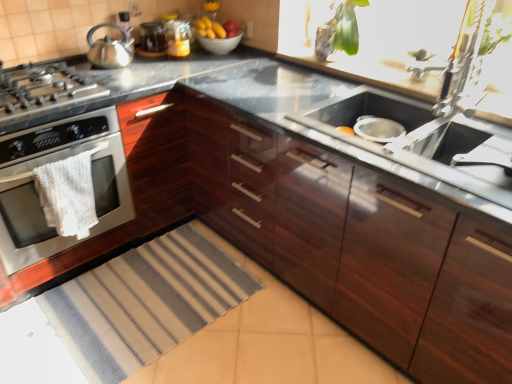
In order to click on vacant space in front of matte glass jar at upper center in this screenshot , I will do `click(154, 60)`.